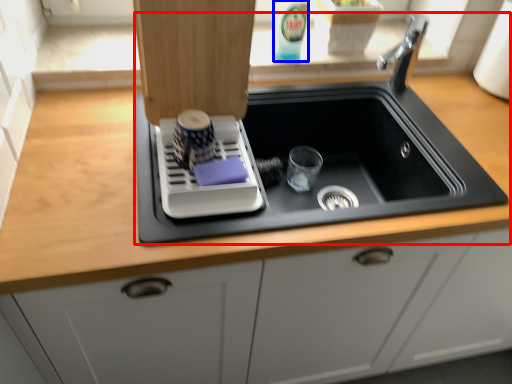
Question: Which of the following is the closest to the observer, sink (highlighted by a red box) or beverage (highlighted by a blue box)?

Choices:
 (A) sink
 (B) beverage

Answer: (A)